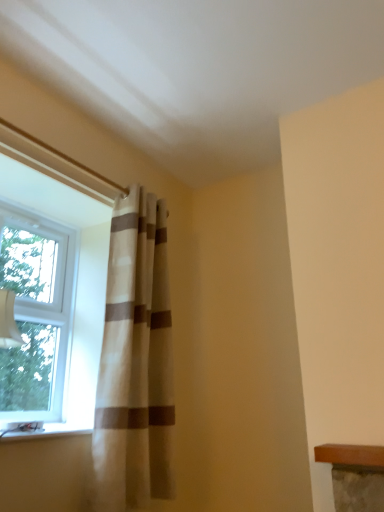
Question: From the image's perspective, is white glossy window sill at lower left positioned above or below beige textured curtain at left?

Choices:
 (A) below
 (B) above

Answer: (A)

Question: Which is correct: white glossy window sill at lower left is inside beige textured curtain at left, or outside of it?

Choices:
 (A) outside
 (B) inside

Answer: (A)

Question: Estimate the real-world distances between objects in this image. Which object is closer to the clear glass window at left?

Choices:
 (A) white glossy window sill at lower left
 (B) beige textured curtain at left

Answer: (B)

Question: Which of these objects is positioned closest to the clear glass window at left?

Choices:
 (A) white glossy window sill at lower left
 (B) beige textured curtain at left

Answer: (B)